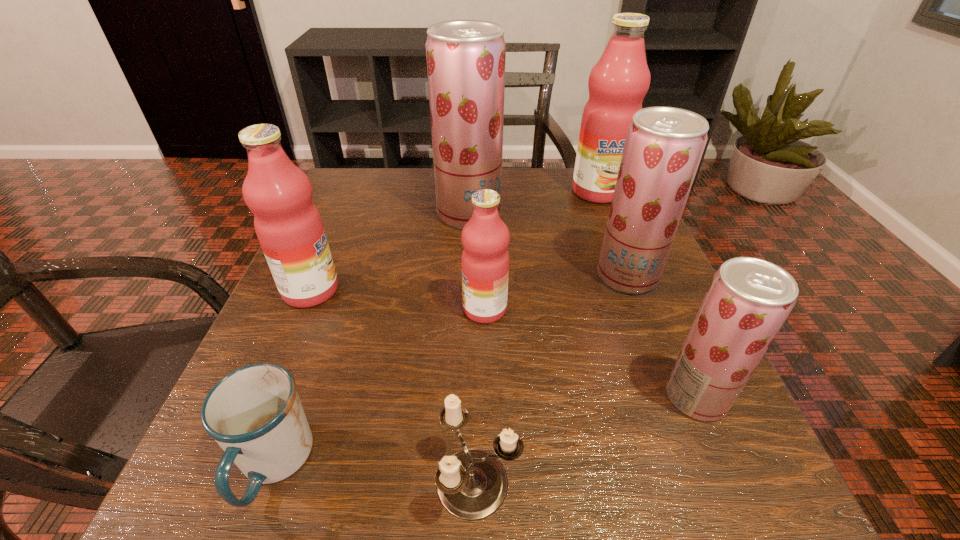
This screenshot has height=540, width=960. What are the coordinates of `the leftmost strawberry fruit juice` in the screenshot? It's located at (465, 58).

Where is `the farthest strawberry fruit juice`? This screenshot has height=540, width=960. the farthest strawberry fruit juice is located at coordinates (465, 58).

Identify the location of the rightmost pink fruit juice. The width and height of the screenshot is (960, 540). (618, 83).

Identify the location of the biggest pink fruit juice. (618, 83).

What are the coordinates of `the second nearest strawberry fruit juice` in the screenshot? It's located at (664, 145).

This screenshot has height=540, width=960. In order to click on the leftmost fruit juice in this screenshot , I will do `click(288, 225)`.

Locate an element on the screen. This screenshot has width=960, height=540. the second smallest pink fruit juice is located at coordinates (288, 225).

Where is `the smallest pink fruit juice`? the smallest pink fruit juice is located at coordinates (485, 237).

The image size is (960, 540). In order to click on the smallest strawberry fruit juice in this screenshot , I will do `click(749, 299)`.

Find the location of `the nearest fruit juice`. the nearest fruit juice is located at coordinates (749, 299).